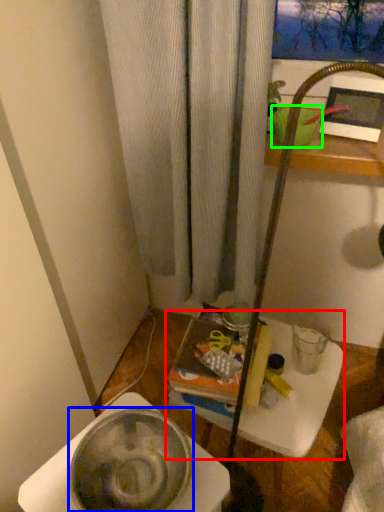
Question: Estimate the real-world distances between objects in this image. Which object is closer to table (highlighted by a red box), basin (highlighted by a blue box) or basin (highlighted by a green box)?

Choices:
 (A) basin
 (B) basin

Answer: (A)